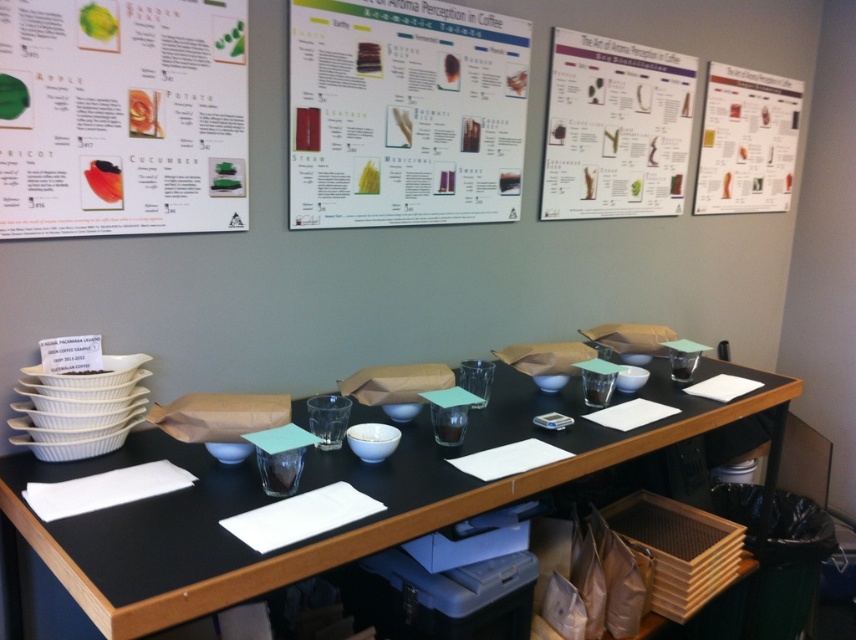
Question: Among these objects, which one is farthest from the camera?

Choices:
 (A) matte paper poster at upper right
 (B) white paperboard poster at upper center
 (C) green paper at upper left
 (D) black matte table at center

Answer: (A)

Question: Among these objects, which one is farthest from the camera?

Choices:
 (A) white paper at upper center
 (B) matte paper poster at upper right
 (C) black matte table at center
 (D) white paperboard poster at upper center

Answer: (B)

Question: Which point is farther from the camera taking this photo?

Choices:
 (A) (569, 36)
 (B) (709, 67)
 (C) (385, 83)
 (D) (191, 536)

Answer: (B)

Question: Observing the image, what is the correct spatial positioning of black matte table at center in reference to white paperboard poster at upper center?

Choices:
 (A) right
 (B) left

Answer: (A)

Question: Is white paperboard poster at upper center to the left of matte paper poster at upper right from the viewer's perspective?

Choices:
 (A) yes
 (B) no

Answer: (A)

Question: From the image, what is the correct spatial relationship of green paper at upper left in relation to matte paper poster at upper right?

Choices:
 (A) right
 (B) left

Answer: (B)